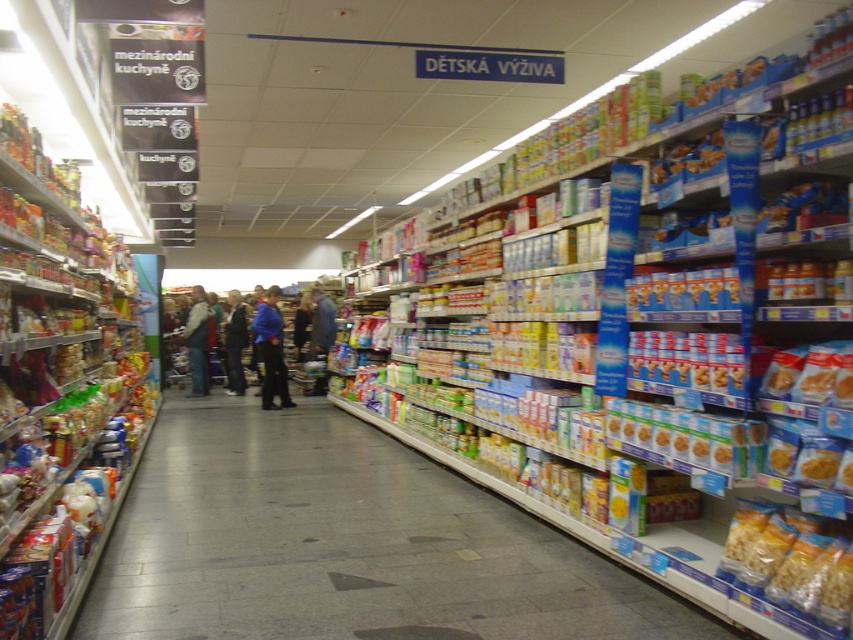
Who is shorter, translucent brown snack at lower right or matte brown snack at center right?

Standing shorter between the two is matte brown snack at center right.

Can you confirm if translucent brown snack at lower right is wider than matte brown snack at center right?

Correct, the width of translucent brown snack at lower right exceeds that of matte brown snack at center right.

Who is more forward, (766, 556) or (693, 442)?

Point (766, 556) is more forward.

Find the location of a particular element. translucent brown snack at lower right is located at coordinates (788, 563).

Image resolution: width=853 pixels, height=640 pixels. What do you see at coordinates (344, 545) in the screenshot?
I see `matte plastic snacks at center` at bounding box center [344, 545].

Can you confirm if matte plastic snacks at center is smaller than light brown corduroy pants at center?

Correct, matte plastic snacks at center occupies less space than light brown corduroy pants at center.

What do you see at coordinates (344, 545) in the screenshot? I see `matte plastic snacks at center` at bounding box center [344, 545].

This screenshot has width=853, height=640. In order to click on matte plastic snacks at center in this screenshot , I will do `click(344, 545)`.

Is light brown corduroy pants at center further to the viewer compared to dark blue jacket at center?

That is False.

Looking at this image, does light brown corduroy pants at center have a greater width compared to dark blue jacket at center?

No, light brown corduroy pants at center is not wider than dark blue jacket at center.

Does point (190, 358) come in front of point (245, 344)?

Yes, it is in front of point (245, 344).

Locate an element on the screen. light brown corduroy pants at center is located at coordinates pos(196,340).